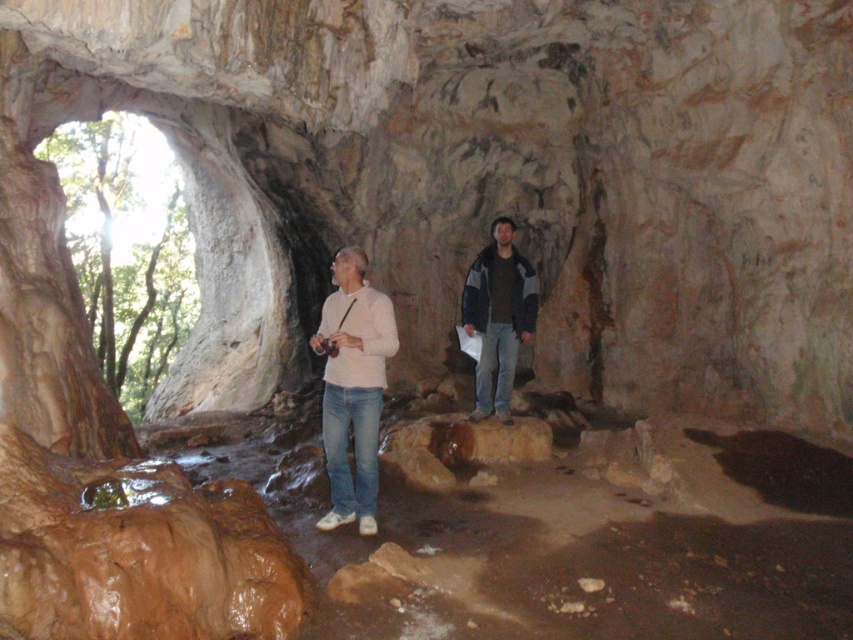
Does light beige jeans at center appear under white matte shirt at center?

Indeed, light beige jeans at center is positioned under white matte shirt at center.

Is point (486, 353) positioned after point (325, 413)?

That is True.

Who is more forward, (346, 372) or (364, 356)?

Point (364, 356) is in front.

The image size is (853, 640). Find the location of `light beige jeans at center`. light beige jeans at center is located at coordinates (352, 387).

Looking at this image, which is below, light beige jeans at center or brown rough rock at center?

brown rough rock at center

Between light beige jeans at center and brown rough rock at center, which one has more height?

light beige jeans at center

Does point (509, 221) come behind point (517, 456)?

Yes, point (509, 221) is behind point (517, 456).

Where is `light beige jeans at center`? The image size is (853, 640). light beige jeans at center is located at coordinates coord(352,387).

Who is positioned more to the right, dark gray fleece jacket at center or brown rough rock at center?

From the viewer's perspective, dark gray fleece jacket at center appears more on the right side.

Does dark gray fleece jacket at center have a smaller size compared to brown rough rock at center?

No.

The height and width of the screenshot is (640, 853). What do you see at coordinates (498, 316) in the screenshot? I see `dark gray fleece jacket at center` at bounding box center [498, 316].

Where is `dark gray fleece jacket at center`? Image resolution: width=853 pixels, height=640 pixels. dark gray fleece jacket at center is located at coordinates (498, 316).